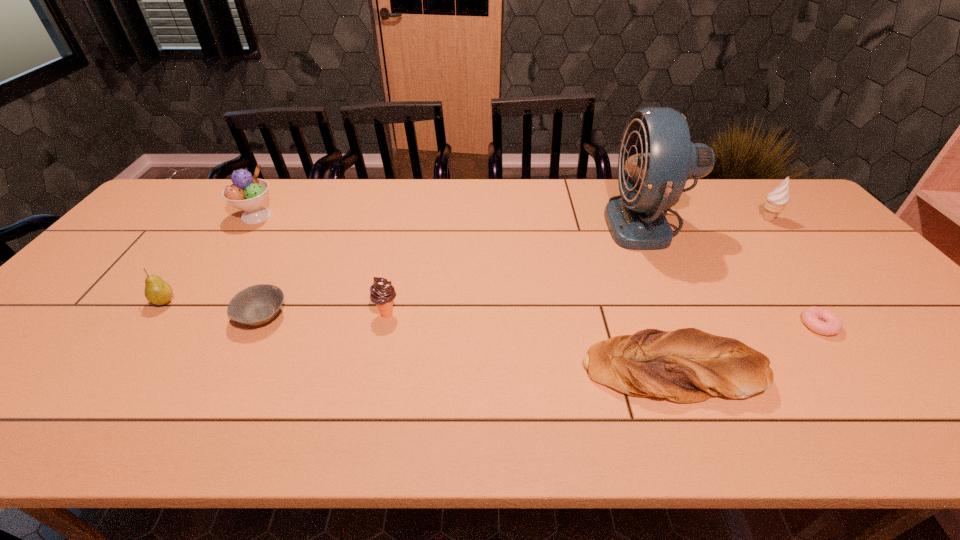
Locate an element on the screen. This screenshot has height=540, width=960. fan is located at coordinates (656, 157).

Where is `the leftmost icecream`? Image resolution: width=960 pixels, height=540 pixels. the leftmost icecream is located at coordinates (247, 193).

The width and height of the screenshot is (960, 540). I want to click on the rightmost object, so click(x=777, y=200).

Locate an element on the screen. This screenshot has height=540, width=960. the fourth tallest object is located at coordinates (382, 293).

You are a GUI agent. You are given a task and a screenshot of the screen. Output one action in this format:
    pyautogui.click(x=<x>, y=<y>)
    Task: Click on the fourth object from left to right
    This screenshot has width=960, height=540.
    Given the screenshot: What is the action you would take?
    pyautogui.click(x=382, y=293)

Find the location of a particular element. the fourth shortest object is located at coordinates tap(157, 291).

I want to click on the sixth tallest object, so click(x=687, y=365).

Identify the location of the third object from left to right. This screenshot has height=540, width=960. (255, 305).

Where is `the seventh tallest object`? The height and width of the screenshot is (540, 960). the seventh tallest object is located at coordinates (255, 305).

Find the location of a particular element. the shortest object is located at coordinates (831, 324).